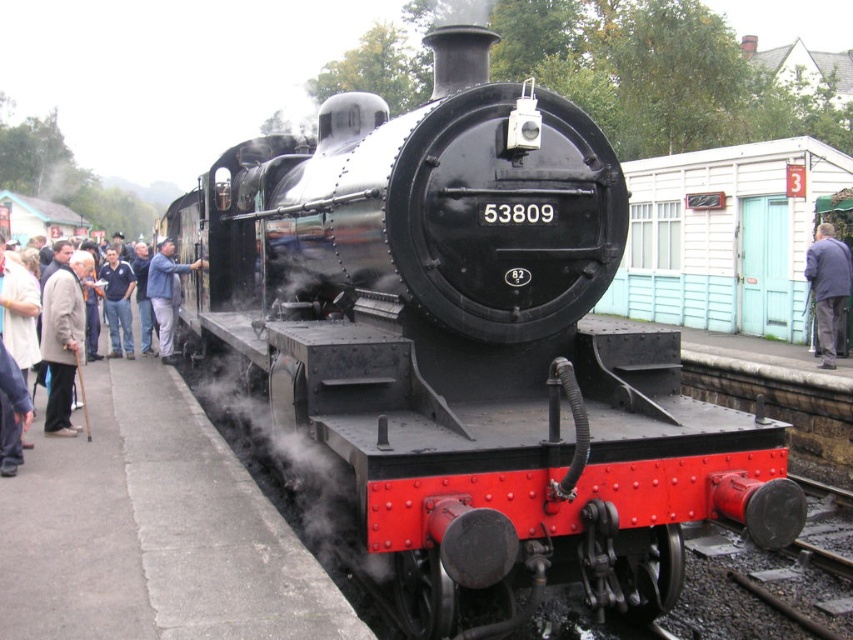
Question: Which object appears farthest from the camera in this image?

Choices:
 (A) denim jacket at left
 (B) light brown leather jacket at left
 (C) blue fabric coat at right

Answer: (A)

Question: Which object is closer to the camera taking this photo?

Choices:
 (A) blue denim jacket at left
 (B) denim jacket at left

Answer: (A)

Question: Is light beige coat at left above light brown leather jacket at left?

Choices:
 (A) yes
 (B) no

Answer: (B)

Question: Is the position of light beige coat at left more distant than that of blue denim jacket at left?

Choices:
 (A) no
 (B) yes

Answer: (A)

Question: Which point is farther to the camera?

Choices:
 (A) (126, 285)
 (B) (838, 308)
 (C) (53, 337)

Answer: (A)

Question: Can you confirm if light beige coat at left is smaller than blue denim jacket at left?

Choices:
 (A) no
 (B) yes

Answer: (B)